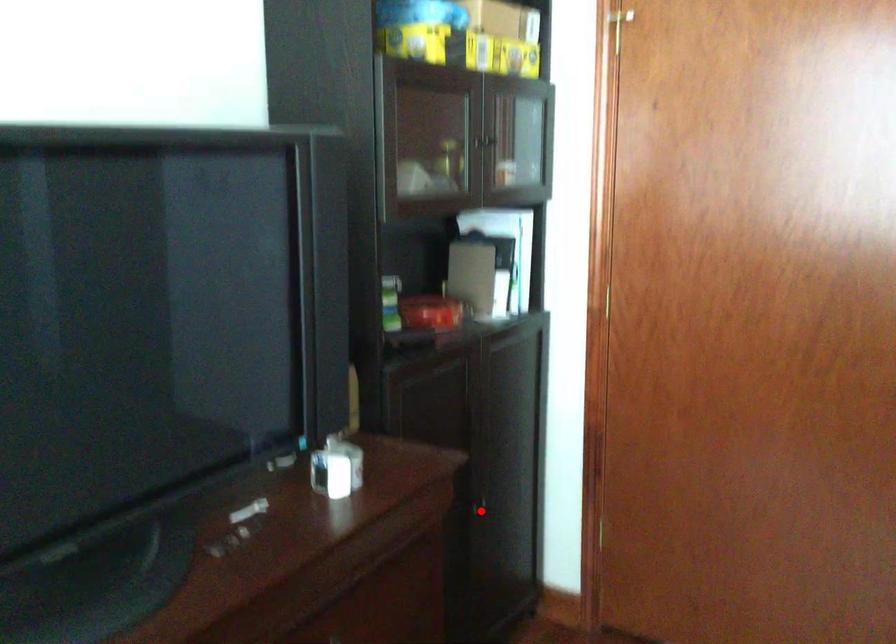
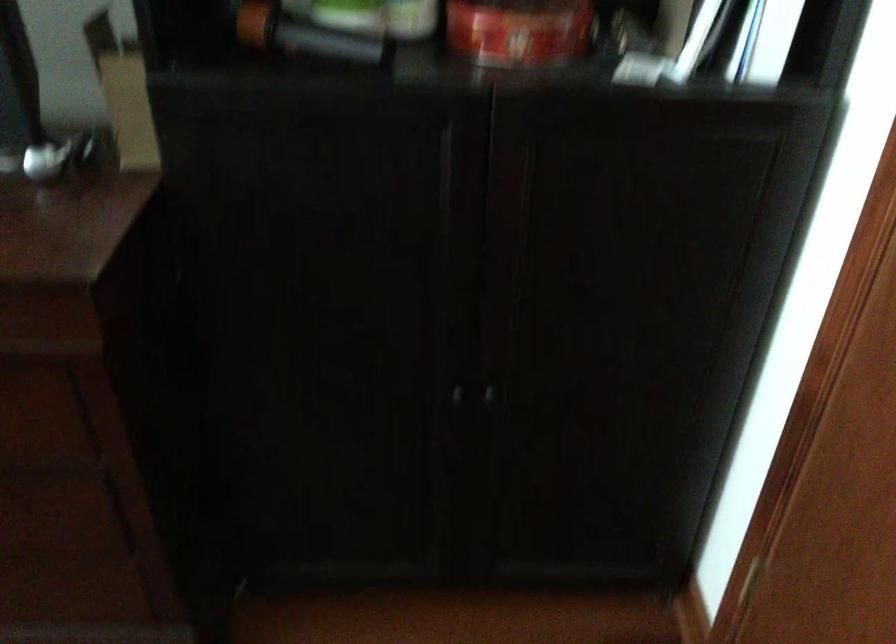
Locate, in the second image, the point that corresponds to the highlighted location in the first image.

(487, 395)